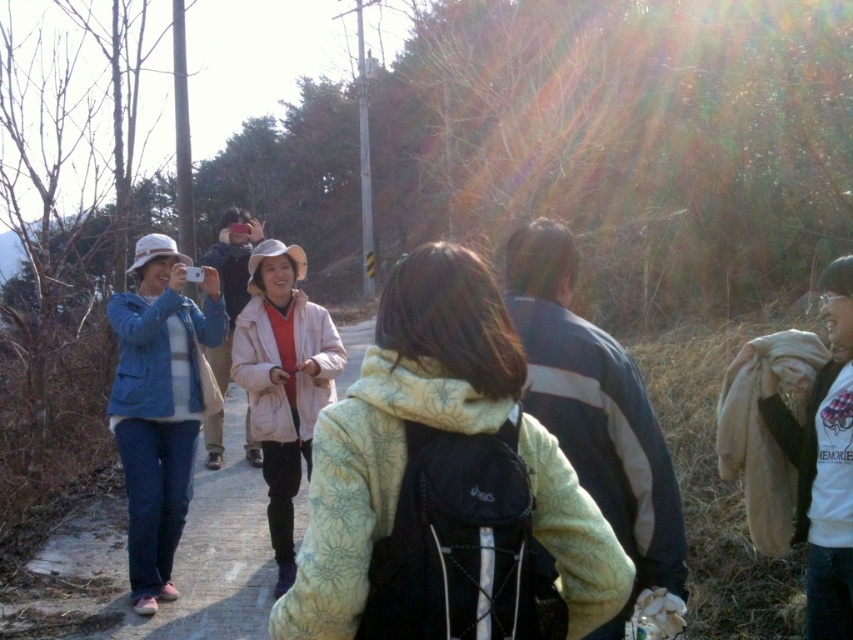
Question: Is fluffy yellow jacket at center to the right of light pink fabric jacket at center from the viewer's perspective?

Choices:
 (A) no
 (B) yes

Answer: (B)

Question: From the image, what is the correct spatial relationship of blue denim jacket at left in relation to light pink fabric jacket at center?

Choices:
 (A) right
 (B) left

Answer: (B)

Question: Considering the real-world distances, which object is farthest from the blue denim jacket at left?

Choices:
 (A) light pink fabric jacket at center
 (B) fluffy yellow jacket at center
 (C) matte blue jacket at left

Answer: (B)

Question: Where is matte blue jacket at left located in relation to light pink fabric jacket at center in the image?

Choices:
 (A) below
 (B) above

Answer: (A)

Question: Which object is positioned farthest from the light pink fabric jacket at center?

Choices:
 (A) blue denim jacket at left
 (B) matte blue jacket at left

Answer: (A)

Question: Which object is farther from the camera taking this photo?

Choices:
 (A) light pink fabric jacket at center
 (B) matte blue jacket at left
 (C) fluffy yellow jacket at center

Answer: (A)